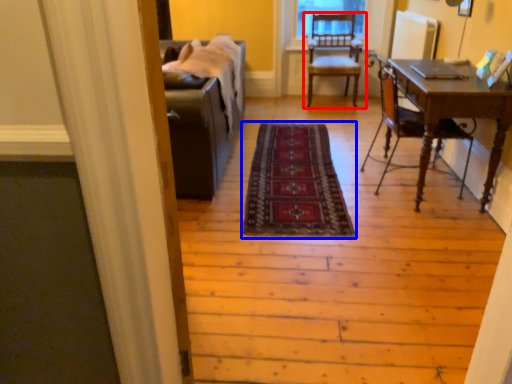
Question: Which object is closer to the camera taking this photo, chair (highlighted by a red box) or mat (highlighted by a blue box)?

Choices:
 (A) chair
 (B) mat

Answer: (B)